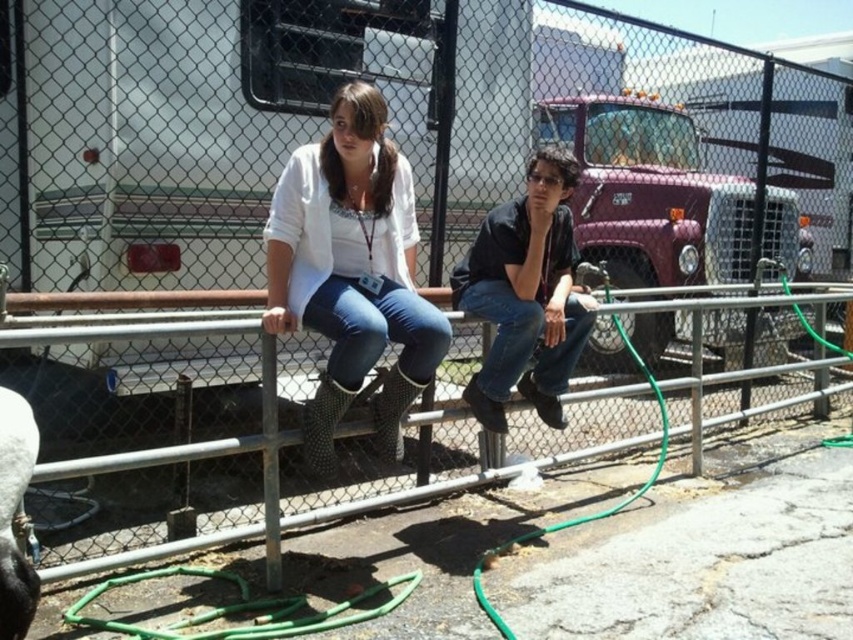
Between white plastic trailer at upper left and white matte boots at left, which one is positioned higher?

white plastic trailer at upper left is above.

Which is in front, point (526, 84) or point (277, 243)?

Point (277, 243) is in front.

Is point (364, 65) farther from camera compared to point (395, 236)?

Yes, point (364, 65) is behind point (395, 236).

The width and height of the screenshot is (853, 640). In order to click on white plastic trailer at upper left in this screenshot , I will do `click(410, 140)`.